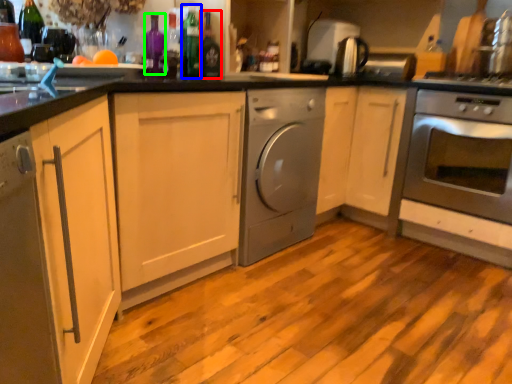
Question: Based on their relative distances, which object is nearer to bottle (highlighted by a red box)? Choose from bottle (highlighted by a blue box) and bottle (highlighted by a green box).

Choices:
 (A) bottle
 (B) bottle

Answer: (A)